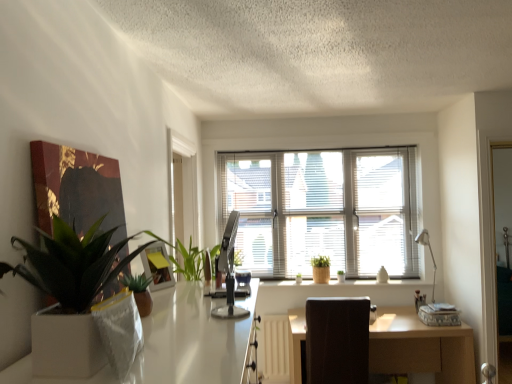
Question: Is yellow paper picture frame at upper center at the left side of brown fabric swivel chair at center?

Choices:
 (A) yes
 (B) no

Answer: (A)

Question: From a real-world perspective, is yellow paper picture frame at upper center over brown fabric swivel chair at center?

Choices:
 (A) yes
 (B) no

Answer: (A)

Question: Is yellow paper picture frame at upper center taller than brown fabric swivel chair at center?

Choices:
 (A) yes
 (B) no

Answer: (B)

Question: Is there a large distance between yellow paper picture frame at upper center and brown fabric swivel chair at center?

Choices:
 (A) no
 (B) yes

Answer: (B)

Question: Is the depth of yellow paper picture frame at upper center greater than that of brown fabric swivel chair at center?

Choices:
 (A) yes
 (B) no

Answer: (B)

Question: Considering their positions, is white blinds at center located in front of or behind light brown wooden desk at center?

Choices:
 (A) behind
 (B) front

Answer: (A)

Question: From the image's perspective, is white blinds at center located above or below light brown wooden desk at center?

Choices:
 (A) above
 (B) below

Answer: (A)

Question: Considering the positions of point (402, 195) and point (416, 365), is point (402, 195) closer or farther from the camera than point (416, 365)?

Choices:
 (A) farther
 (B) closer

Answer: (A)

Question: In terms of size, does white blinds at center appear bigger or smaller than light brown wooden desk at center?

Choices:
 (A) big
 (B) small

Answer: (B)

Question: Based on their positions, is white glossy desk at center located to the left or right of white ceramic vase at center?

Choices:
 (A) left
 (B) right

Answer: (A)

Question: Is point coord(193,337) closer or farther from the camera than point coord(428,286)?

Choices:
 (A) farther
 (B) closer

Answer: (B)

Question: Is white glossy desk at center inside the boundaries of white ceramic vase at center, or outside?

Choices:
 (A) inside
 (B) outside

Answer: (B)

Question: Is white glossy desk at center taller or shorter than white ceramic vase at center?

Choices:
 (A) tall
 (B) short

Answer: (A)

Question: Is brown fabric swivel chair at center inside the boundaries of light brown wooden desk at center, or outside?

Choices:
 (A) inside
 (B) outside

Answer: (A)

Question: In the image, is brown fabric swivel chair at center on the left side or the right side of light brown wooden desk at center?

Choices:
 (A) right
 (B) left

Answer: (B)